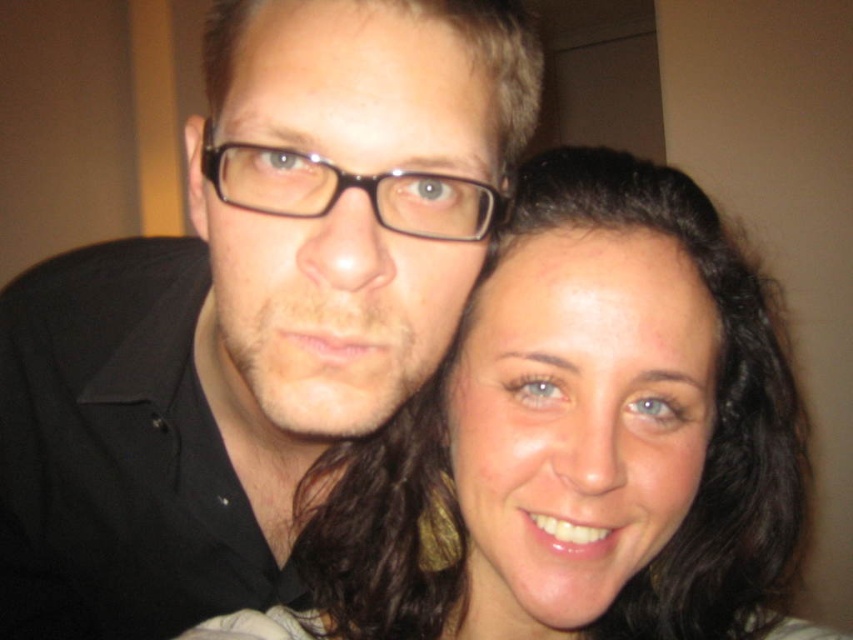
You are a photographer trying to adjust the lighting to ensure both the matte black shirt at left and the matte black hair at center are evenly illuminated. Considering their sizes, which object might require more light to achieve proper exposure?

The matte black shirt at left has a larger size compared to the matte black hair at center, so it might require more light to achieve proper exposure.

You are taking a photo of two people and notice the matte black hair at center and the black plastic glasses at center. Which object is positioned lower in the image?

The matte black hair at center is positioned below the black plastic glasses at center, so it is lower in the image.

You are a photographer setting up a portrait session. You need to ensure that the matte black shirt at left and the matte black hair at center are both visible in the frame. Based on their positions, which object should you focus on first to ensure proper exposure?

The matte black shirt at left is above the matte black hair at center. Since the shirt is positioned higher in the frame, you should focus on the matte black shirt at left first to ensure proper exposure, as it may be more likely to be in the brighter part of the image due to its elevated position.